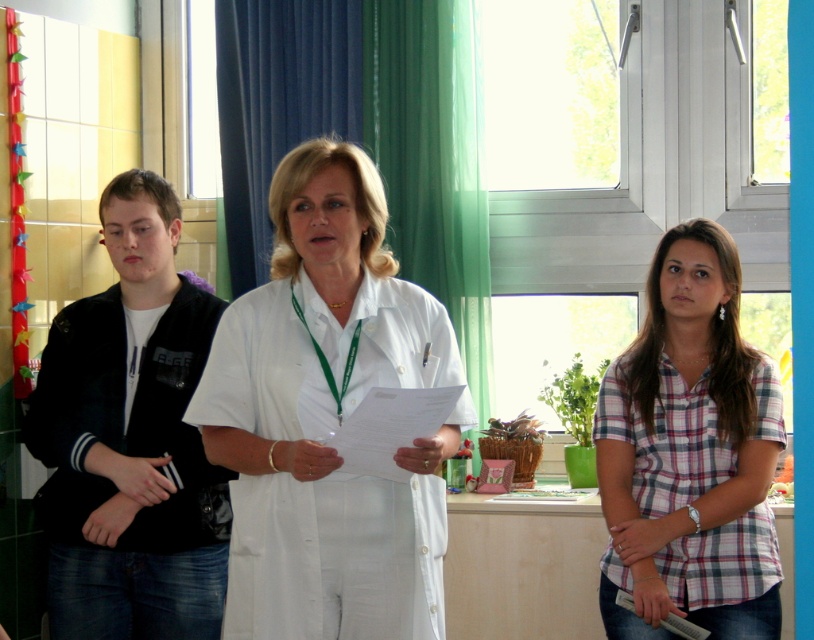
Question: Can you confirm if plaid cotton shirt at center is bigger than green fabric curtain at center?

Choices:
 (A) no
 (B) yes

Answer: (A)

Question: Among these objects, which one is farthest from the camera?

Choices:
 (A) plaid cotton shirt at center
 (B) green fabric curtain at center

Answer: (B)

Question: Is the position of black matte jacket at left less distant than that of plaid cotton shirt at center?

Choices:
 (A) no
 (B) yes

Answer: (A)

Question: Considering the real-world distances, which object is farthest from the plaid cotton shirt at center?

Choices:
 (A) white matte uniform at center
 (B) black matte jacket at left
 (C) green fabric curtain at center

Answer: (B)

Question: Which of the following is the closest to the observer?

Choices:
 (A) green fabric curtain at center
 (B) black matte jacket at left
 (C) white matte uniform at center
 (D) plaid cotton shirt at center

Answer: (C)

Question: From the image, what is the correct spatial relationship of white matte uniform at center in relation to green fabric curtain at center?

Choices:
 (A) right
 (B) left

Answer: (B)